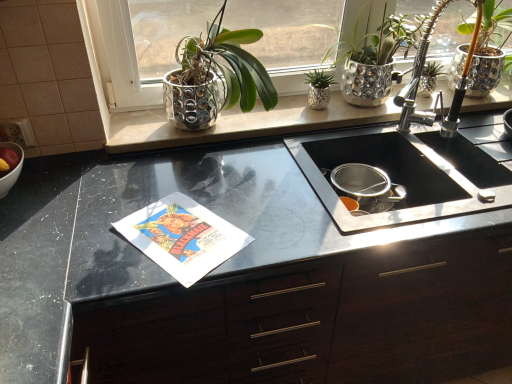
Locate an element on the screen. This screenshot has height=384, width=512. free point above black matte cabinet at center (from a real-world perspective) is located at coordinates (271, 191).